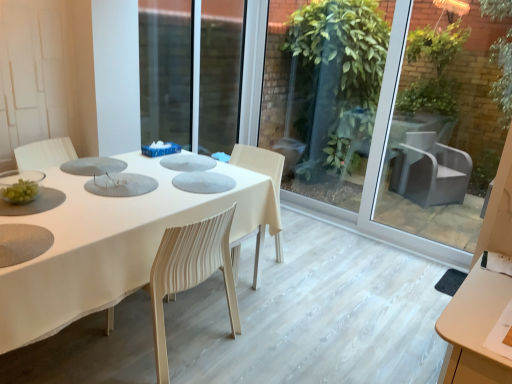
Question: Relative to white striped fabric chair at center, is white fabric table at center in front or behind?

Choices:
 (A) behind
 (B) front

Answer: (B)

Question: Visually, is white fabric table at center positioned to the left or to the right of white striped fabric chair at center?

Choices:
 (A) right
 (B) left

Answer: (B)

Question: Which object is positioned closest to the white striped fabric chair at center?

Choices:
 (A) transparent glass door at center
 (B) white fabric table at center

Answer: (B)

Question: Which object is the farthest from the white striped fabric chair at center?

Choices:
 (A) white fabric table at center
 (B) transparent glass door at center

Answer: (B)